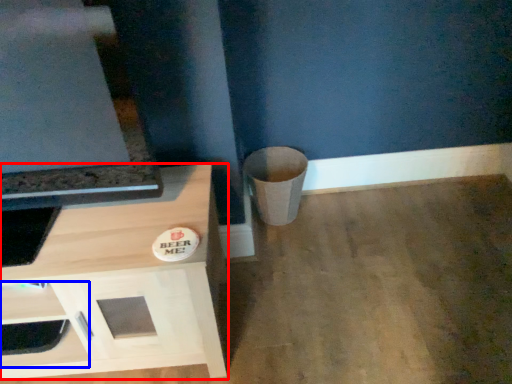
Question: Which object appears closest to the camera in this image, cabinetry (highlighted by a red box) or drawer (highlighted by a blue box)?

Choices:
 (A) cabinetry
 (B) drawer

Answer: (A)